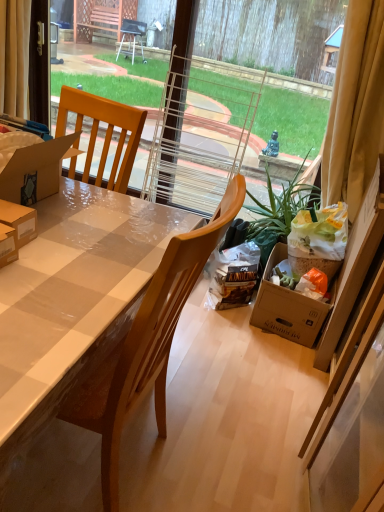
Question: Considering the relative sizes of beige fabric curtain at upper left, the 2th curtain viewed from the right, and yellow fabric curtain at upper right, which ranks as the first curtain in right-to-left order, in the image provided, is beige fabric curtain at upper left, the 2th curtain viewed from the right, wider than yellow fabric curtain at upper right, which ranks as the first curtain in right-to-left order,?

Choices:
 (A) yes
 (B) no

Answer: (B)

Question: Is beige fabric curtain at upper left, placed as the first curtain when sorted from left to right, positioned with its back to yellow fabric curtain at upper right, marked as the 2th curtain in a left-to-right arrangement?

Choices:
 (A) no
 (B) yes

Answer: (A)

Question: Is yellow fabric curtain at upper right, which ranks as the first curtain in right-to-left order, completely or partially inside beige fabric curtain at upper left, the 2th curtain viewed from the right?

Choices:
 (A) yes
 (B) no

Answer: (B)

Question: Is beige fabric curtain at upper left, placed as the first curtain when sorted from left to right, closer to the viewer compared to yellow fabric curtain at upper right, marked as the 2th curtain in a left-to-right arrangement?

Choices:
 (A) yes
 (B) no

Answer: (B)

Question: From a real-world perspective, is beige fabric curtain at upper left, placed as the first curtain when sorted from left to right, under yellow fabric curtain at upper right, which ranks as the first curtain in right-to-left order?

Choices:
 (A) no
 (B) yes

Answer: (B)

Question: Does beige fabric curtain at upper left, the 2th curtain viewed from the right, lie behind yellow fabric curtain at upper right, which ranks as the first curtain in right-to-left order?

Choices:
 (A) no
 (B) yes

Answer: (B)

Question: Considering the relative sizes of wooden chair at center and beige fabric curtain at upper left, the 2th curtain viewed from the right, in the image provided, is wooden chair at center wider than beige fabric curtain at upper left, the 2th curtain viewed from the right,?

Choices:
 (A) yes
 (B) no

Answer: (A)

Question: Can you confirm if wooden chair at center is positioned to the left of beige fabric curtain at upper left, placed as the first curtain when sorted from left to right?

Choices:
 (A) yes
 (B) no

Answer: (B)

Question: Considering the relative sizes of wooden chair at center and beige fabric curtain at upper left, placed as the first curtain when sorted from left to right, in the image provided, is wooden chair at center taller than beige fabric curtain at upper left, placed as the first curtain when sorted from left to right,?

Choices:
 (A) no
 (B) yes

Answer: (B)

Question: From the image's perspective, is wooden chair at center on beige fabric curtain at upper left, the 2th curtain viewed from the right?

Choices:
 (A) no
 (B) yes

Answer: (A)

Question: Does wooden chair at center have a lesser height compared to beige fabric curtain at upper left, placed as the first curtain when sorted from left to right?

Choices:
 (A) yes
 (B) no

Answer: (B)

Question: Is wooden chair at center positioned before beige fabric curtain at upper left, the 2th curtain viewed from the right?

Choices:
 (A) yes
 (B) no

Answer: (A)

Question: Is beige fabric curtain at upper left, the 2th curtain viewed from the right, a part of yellow fabric curtain at upper right, which ranks as the first curtain in right-to-left order?

Choices:
 (A) yes
 (B) no

Answer: (B)